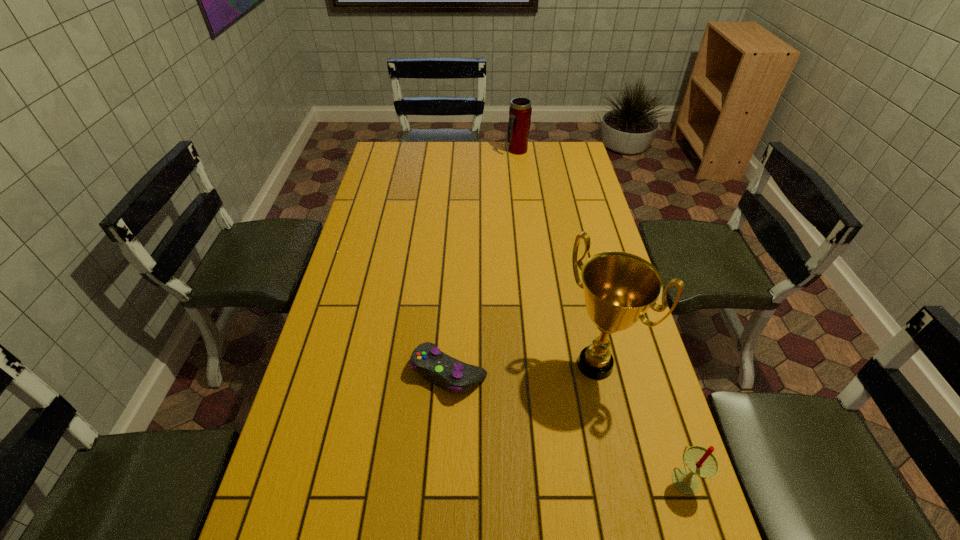
The height and width of the screenshot is (540, 960). Find the location of `free spot located on the side with the handle of the thermos bottle`. free spot located on the side with the handle of the thermos bottle is located at coordinates (520, 169).

The image size is (960, 540). Find the location of `vacant space located on the side with the handle of the thermos bottle`. vacant space located on the side with the handle of the thermos bottle is located at coordinates (524, 188).

Find the location of a particular element. vacant area situated 0.070m on the front view with handles of the tallest object is located at coordinates pyautogui.click(x=559, y=404).

In order to click on vacant position located 0.180m on the front view with handles of the tallest object in this screenshot , I will do pyautogui.click(x=532, y=436).

I want to click on vacant region located 0.150m on the front view with handles of the tallest object, so click(540, 427).

Locate an element on the screen. object situated at the far edge is located at coordinates (520, 111).

Find the location of a particular element. The image size is (960, 540). candle that is at the right edge is located at coordinates (701, 462).

You are a GUI agent. You are given a task and a screenshot of the screen. Output one action in this format:
    pyautogui.click(x=<x>, y=<y>)
    Task: Click on the award present at the right edge
    
    Given the screenshot: What is the action you would take?
    pyautogui.click(x=619, y=287)

This screenshot has width=960, height=540. What are the coordinates of `vacant area at the far edge` in the screenshot? It's located at [529, 145].

This screenshot has width=960, height=540. In order to click on free space at the left edge of the desktop in this screenshot , I will do `click(388, 218)`.